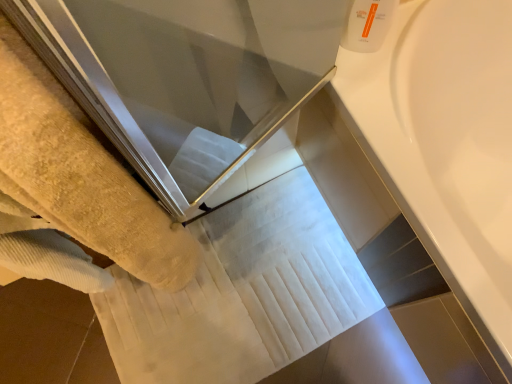
Where is `vacant area that is situated to the right of white plastic bottle at upper right`? vacant area that is situated to the right of white plastic bottle at upper right is located at coordinates (411, 36).